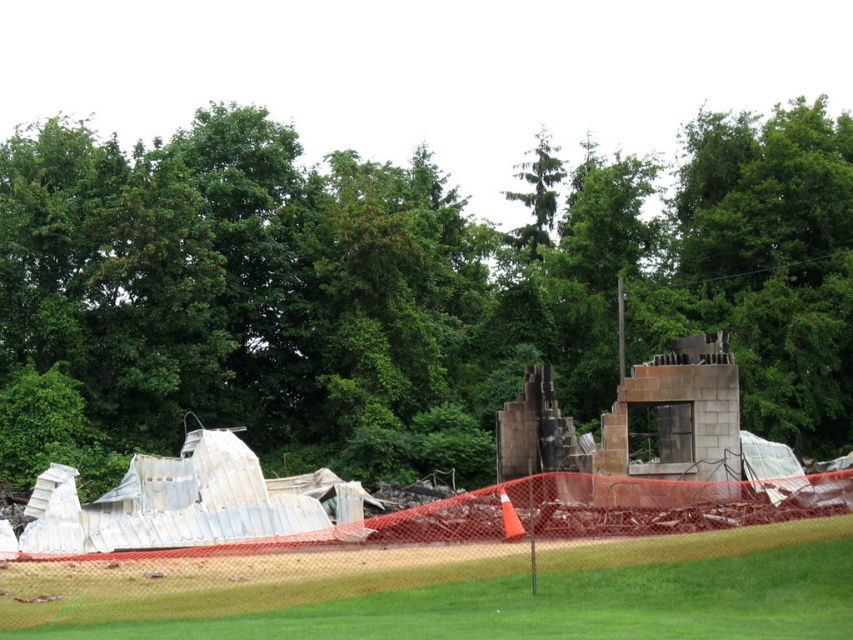
You are a safety inspector assessing the demolition site. You notice the green leafy tree at upper center and the green grass at lower center. Which of these two has a larger size in the image?

The green leafy tree at upper center is bigger than the green grass at lower center according to the description.

You are a construction worker standing at the point marked by coordinates point (399, 292). You need to move towards the orange safety netting in the foreground. Which direction should you go to reach the orange safety netting?

The point (399, 292) marks the green leafy tree at upper center, so you should move downward towards the foreground to reach the orange safety netting.

You are a construction worker assessing the demolition site. You notice the green leafy tree at upper center and the green grass at lower center. Which object is taller?

The green leafy tree at upper center is taller than the green grass at lower center according to the description.